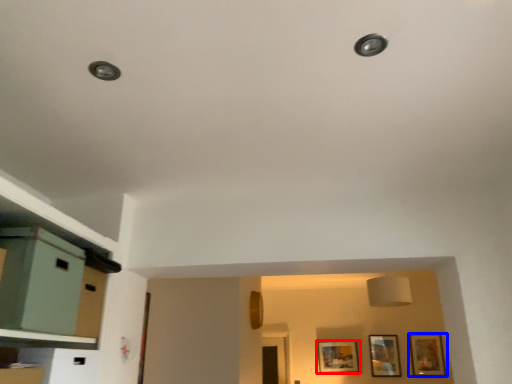
Question: Which of the following is the closest to the observer, picture frame (highlighted by a red box) or picture frame (highlighted by a blue box)?

Choices:
 (A) picture frame
 (B) picture frame

Answer: (B)